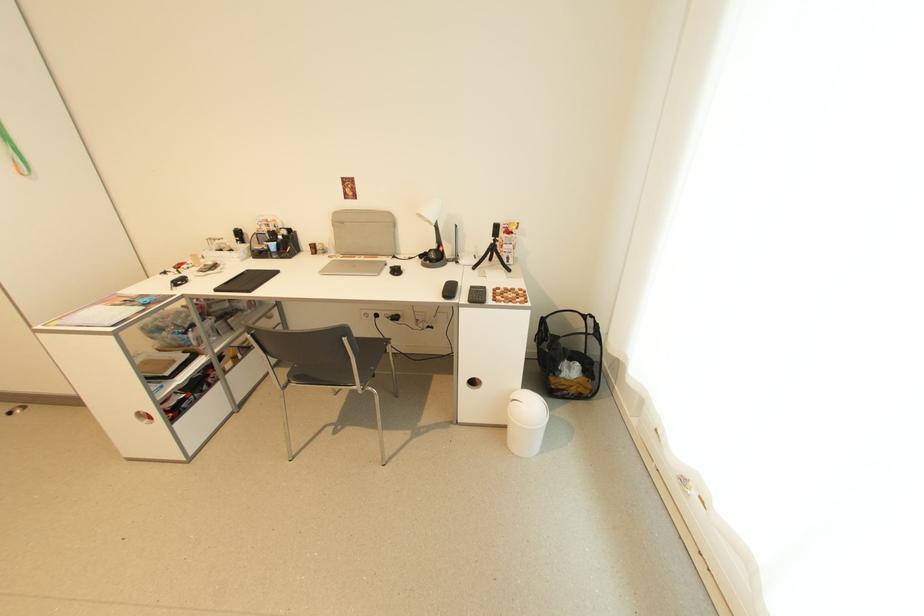
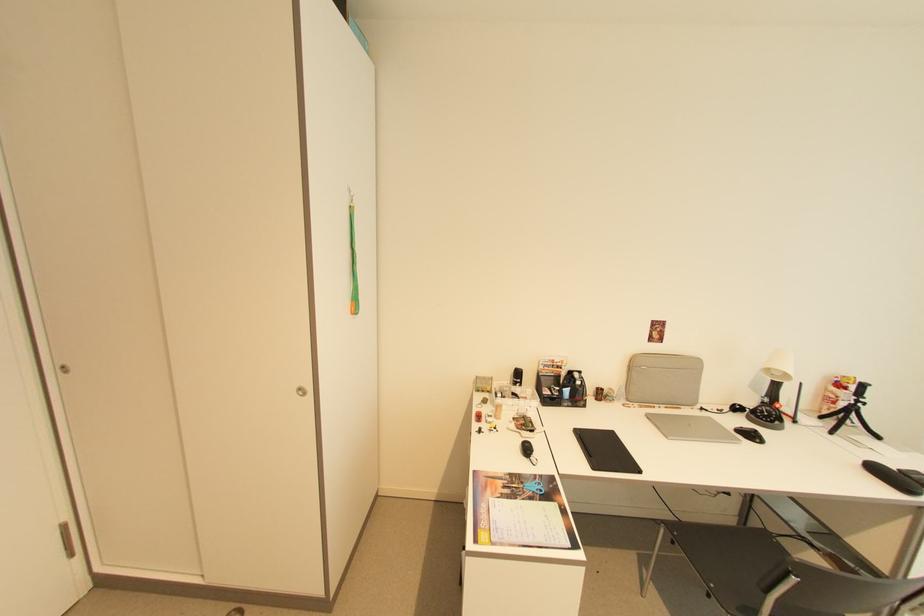
Locate, in the second image, the point that corresponds to (400,276) in the first image.

(762, 442)